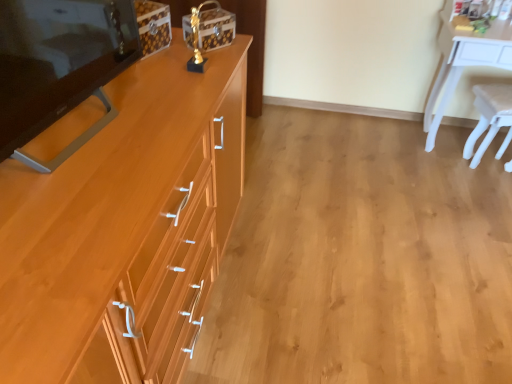
Question: Can we say light brown wood cabinet at left lies outside matte wood changing table at left?

Choices:
 (A) yes
 (B) no

Answer: (A)

Question: Can you confirm if light brown wood cabinet at left is wider than matte wood changing table at left?

Choices:
 (A) no
 (B) yes

Answer: (B)

Question: Is light brown wood cabinet at left to the left of matte wood changing table at left from the viewer's perspective?

Choices:
 (A) no
 (B) yes

Answer: (A)

Question: Is light brown wood cabinet at left closer to camera compared to matte wood changing table at left?

Choices:
 (A) no
 (B) yes

Answer: (B)

Question: Can you confirm if light brown wood cabinet at left is thinner than matte wood changing table at left?

Choices:
 (A) no
 (B) yes

Answer: (A)

Question: From a real-world perspective, is white plastic chair at right physically located above or below wooden drawer at center-left?

Choices:
 (A) below
 (B) above

Answer: (B)

Question: Is white plastic chair at right to the left or to the right of wooden drawer at center-left in the image?

Choices:
 (A) right
 (B) left

Answer: (A)

Question: From the image's perspective, is white plastic chair at right above or below wooden drawer at center-left?

Choices:
 (A) above
 (B) below

Answer: (A)

Question: Looking at the image, does white plastic chair at right seem bigger or smaller compared to wooden drawer at center-left?

Choices:
 (A) small
 (B) big

Answer: (A)

Question: Visually, is white plastic chair at right positioned to the left or to the right of light brown wood cabinet at left?

Choices:
 (A) left
 (B) right

Answer: (B)

Question: Does point (478, 157) appear closer or farther from the camera than point (13, 268)?

Choices:
 (A) farther
 (B) closer

Answer: (A)

Question: Is white plastic chair at right in front of or behind light brown wood cabinet at left in the image?

Choices:
 (A) front
 (B) behind

Answer: (B)

Question: Is white plastic chair at right bigger or smaller than light brown wood cabinet at left?

Choices:
 (A) big
 (B) small

Answer: (B)

Question: Is matte wood changing table at left in front of or behind white plastic chair at right in the image?

Choices:
 (A) behind
 (B) front

Answer: (B)

Question: In the image, is matte wood changing table at left on the left side or the right side of white plastic chair at right?

Choices:
 (A) right
 (B) left

Answer: (B)